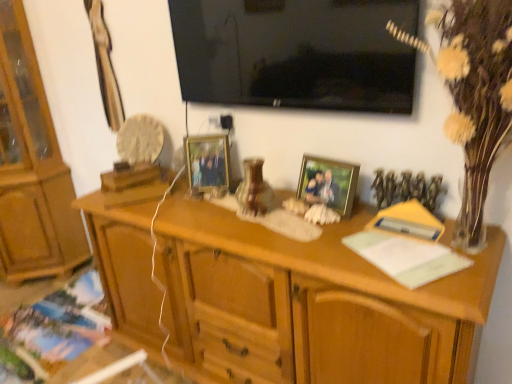
What are the coordinates of `free spot above matte paper book at lower left, acting as the first book starting from the back (from a real-world perspective)` in the screenshot? It's located at (37, 343).